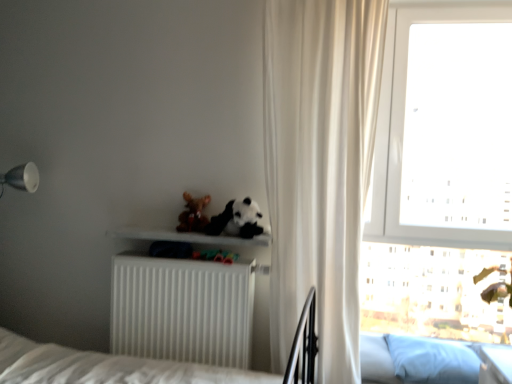
This screenshot has height=384, width=512. In order to click on vacant space situated above blue fabric pillow at lower right (from a real-world perspective) in this screenshot , I will do `click(441, 349)`.